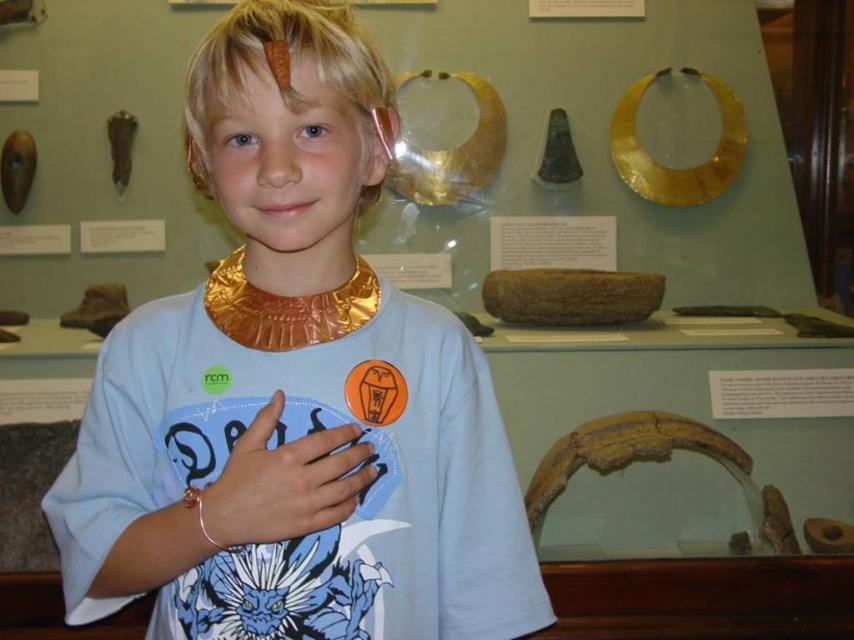
You are a security guard at the museum and need to inspect both the matte gold necklace at center and the matte gold bracelet at center. Which one should you check first without moving your position?

You should check the matte gold necklace at center first because it is closer to you than the matte gold bracelet at center, so it can be inspected without moving your position first.

You are an appraiser assessing the jewelry in the image. You need to determine which of the two items at center, the matte gold necklace at center or the matte gold bracelet at center, is positioned higher up on the person. Based on the description, which one is taller?

The matte gold necklace at center is taller than the matte gold bracelet at center, so the necklace is positioned higher up on the person.

You are a museum security guard checking the dimensions of the artifacts. You have a display case that can only accommodate items wider than 10 cm. Given that the matte gold necklace at center is wider than the matte gold bracelet at center, can you confirm if both items will fit in the display case?

The matte gold necklace at center is wider than the matte gold bracelet at center. However, since the display case requires items wider than 10 cm, we need to know the exact width of the necklace. Without specific measurements, we cannot confirm if both items meet the requirement.